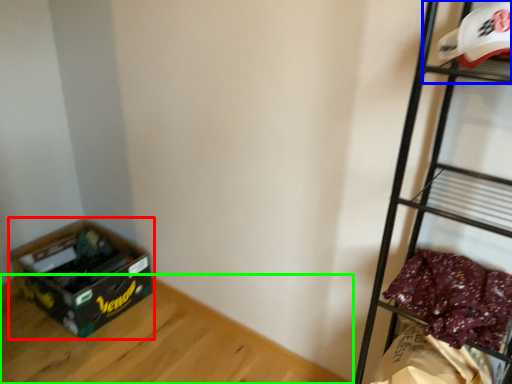
Question: Considering the real-world distances, which object is closest to storage box (highlighted by a red box)? shelf (highlighted by a blue box) or furniture (highlighted by a green box).

Choices:
 (A) shelf
 (B) furniture

Answer: (B)